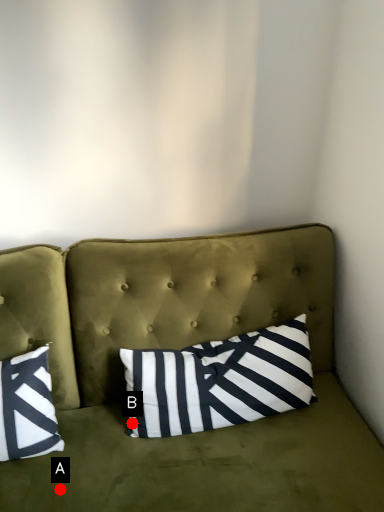
Question: Two points are circled on the image, labeled by A and B beside each circle. Which of the following is the farthest from the observer?

Choices:
 (A) A is further
 (B) B is further

Answer: (B)